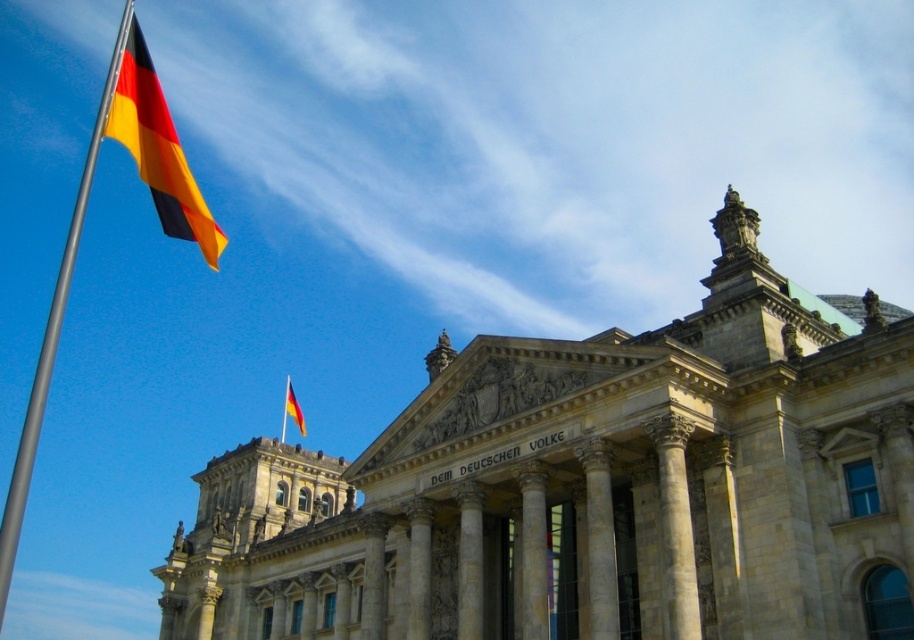
Question: Is metallic pole at left wider than matte fabric flag at upper left?

Choices:
 (A) yes
 (B) no

Answer: (A)

Question: Which of the following is the farthest from the observer?

Choices:
 (A) white marble pillar at center
 (B) metallic pole at left
 (C) polished metal flag pole at upper left

Answer: (C)

Question: Which point is farther to the camera?

Choices:
 (A) (479, 580)
 (B) (296, 416)

Answer: (B)

Question: Can you confirm if polished fabric flag at upper left is thinner than polished metal flag pole at upper left?

Choices:
 (A) yes
 (B) no

Answer: (B)

Question: Which object appears farthest from the camera in this image?

Choices:
 (A) polished fabric flag at upper left
 (B) white marble pillar at center
 (C) polished metal flag pole at upper left
 (D) matte fabric flag at upper left

Answer: (D)

Question: Can you confirm if polished fabric flag at upper left is thinner than matte fabric flag at upper left?

Choices:
 (A) yes
 (B) no

Answer: (B)